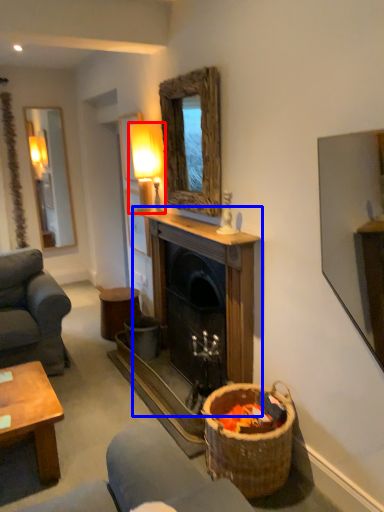
Question: Which point is closer to the camera, lamp (highlighted by a red box) or fireplace (highlighted by a blue box)?

Choices:
 (A) lamp
 (B) fireplace

Answer: (B)